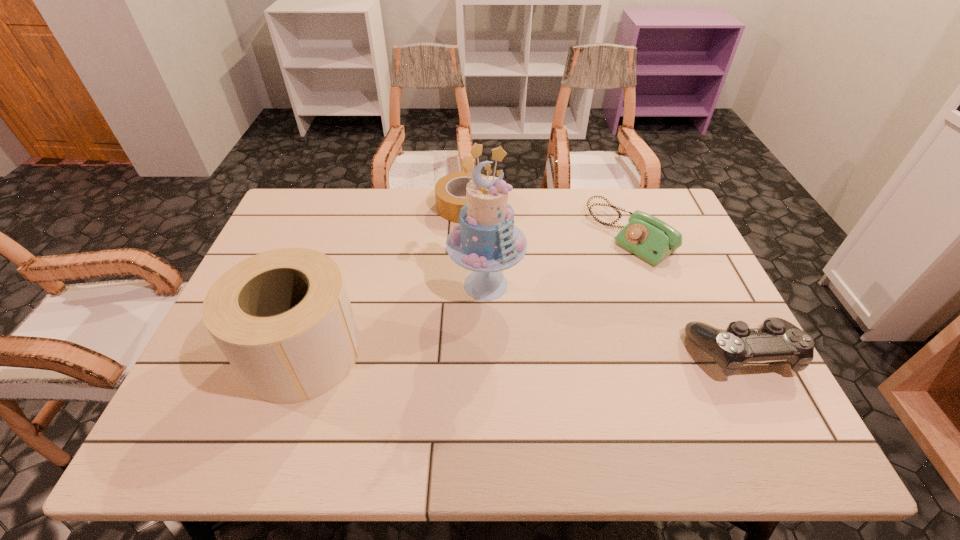
Identify the location of vacant space at the far left corner. (329, 200).

Where is `free space at the near left corner of the desktop`? free space at the near left corner of the desktop is located at coordinates (206, 383).

Locate an element on the screen. Image resolution: width=960 pixels, height=540 pixels. vacant space at the far right corner of the desktop is located at coordinates (635, 196).

I want to click on vacant space at the near right corner, so click(x=738, y=373).

Identify the location of blank region between the shortest object and the telephone. (548, 221).

In order to click on free space that is in between the control and the telephone in this screenshot , I will do `click(685, 293)`.

This screenshot has height=540, width=960. Find the location of `empty space that is in between the telephone and the control`. empty space that is in between the telephone and the control is located at coordinates (685, 293).

Locate an element on the screen. This screenshot has width=960, height=540. free space between the leftmost object and the telephone is located at coordinates (467, 293).

You are a GUI agent. You are given a task and a screenshot of the screen. Output one action in this format:
    pyautogui.click(x=<x>, y=<y>)
    Task: Click on the vacant area between the control and the cake
    The width and height of the screenshot is (960, 540).
    Given the screenshot: What is the action you would take?
    pyautogui.click(x=613, y=319)

Image resolution: width=960 pixels, height=540 pixels. Identify the location of free point between the cake and the telephone. (559, 260).